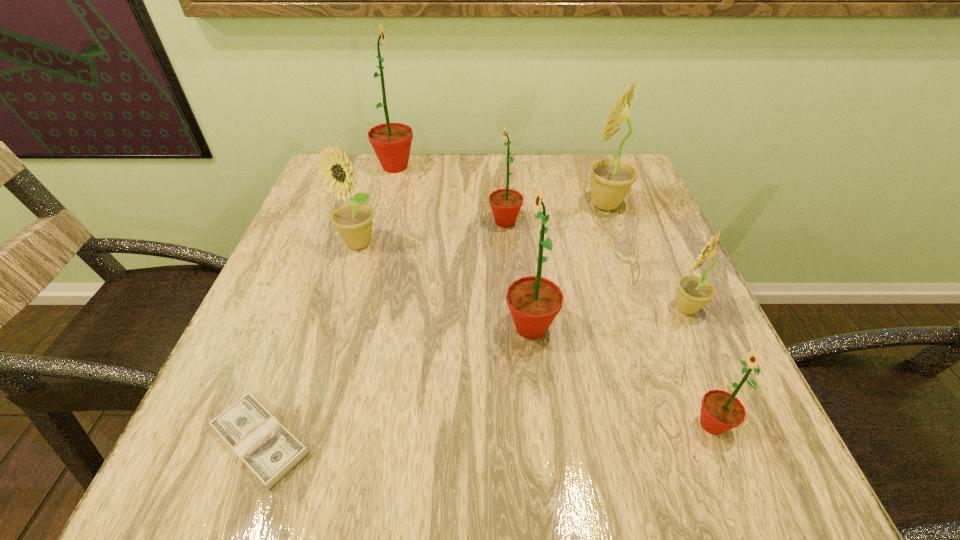
The height and width of the screenshot is (540, 960). I want to click on the tallest object, so click(x=391, y=142).

I want to click on the leftmost green sunflower, so click(x=391, y=142).

Where is `the farthest yellow sunflower`? The image size is (960, 540). the farthest yellow sunflower is located at coordinates (611, 180).

At what (x,y) coordinates should I click in order to perform the action: click on the second biggest green sunflower. Please return your answer as a coordinate pair (x, y). The image size is (960, 540). Looking at the image, I should click on (x=534, y=301).

Locate an element on the screen. the third biggest green sunflower is located at coordinates (505, 203).

Identify the location of the leftmost yellow sunflower. This screenshot has width=960, height=540. tap(353, 222).

Where is `the second farthest yellow sunflower`? The height and width of the screenshot is (540, 960). the second farthest yellow sunflower is located at coordinates point(353,222).

Image resolution: width=960 pixels, height=540 pixels. I want to click on the smallest yellow sunflower, so click(693, 292).

I want to click on the nearest green sunflower, so click(x=721, y=411).

Where is `the nearest sunflower`? Image resolution: width=960 pixels, height=540 pixels. the nearest sunflower is located at coordinates (721, 411).